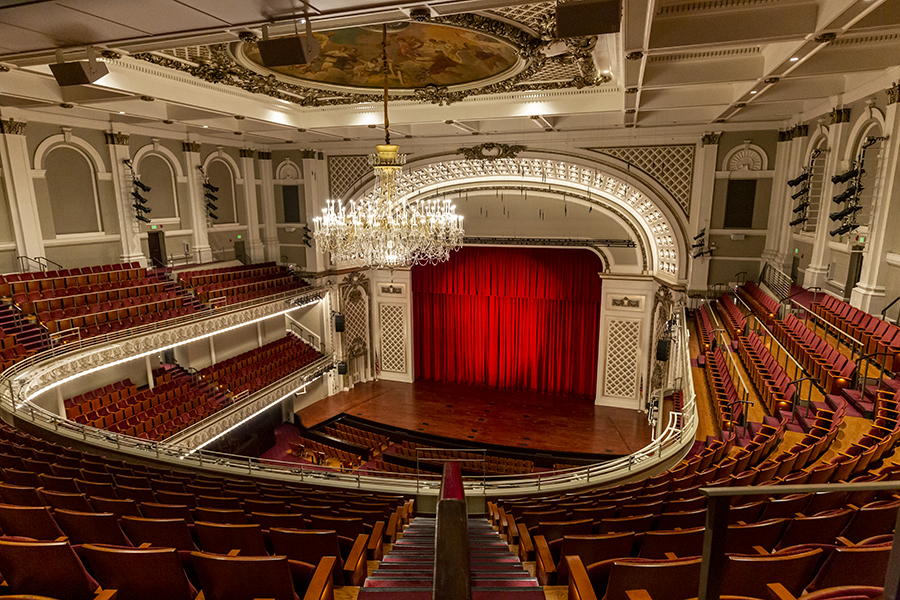
Identify the location of stairs. (508, 569).